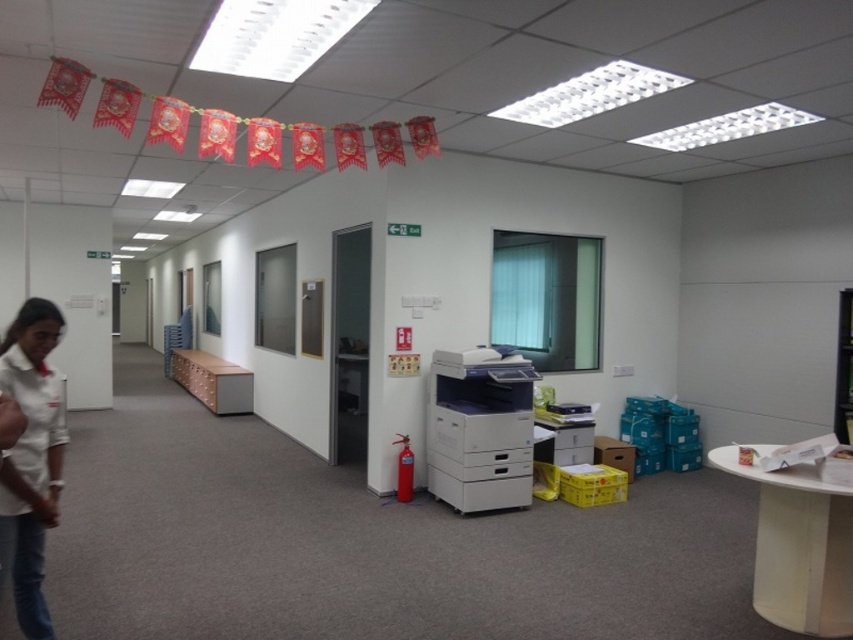
Question: Which object appears closest to the camera in this image?

Choices:
 (A) white plastic printer at center
 (B) white fabric shirt at left

Answer: (B)

Question: Estimate the real-world distances between objects in this image. Which object is closer to the wooden/file cabinet at center?

Choices:
 (A) white plastic printer at center
 (B) white fabric shirt at left

Answer: (A)

Question: Can you confirm if white fabric shirt at left is positioned below wooden/file cabinet at center?

Choices:
 (A) yes
 (B) no

Answer: (B)

Question: Can you confirm if white fabric shirt at left is smaller than wooden/file cabinet at center?

Choices:
 (A) no
 (B) yes

Answer: (B)

Question: Which point is farther from the camera taking this photo?

Choices:
 (A) (193, 371)
 (B) (457, 432)
 (C) (28, 356)

Answer: (A)

Question: Is white fabric shirt at left closer to camera compared to wooden/file cabinet at center?

Choices:
 (A) no
 (B) yes

Answer: (B)